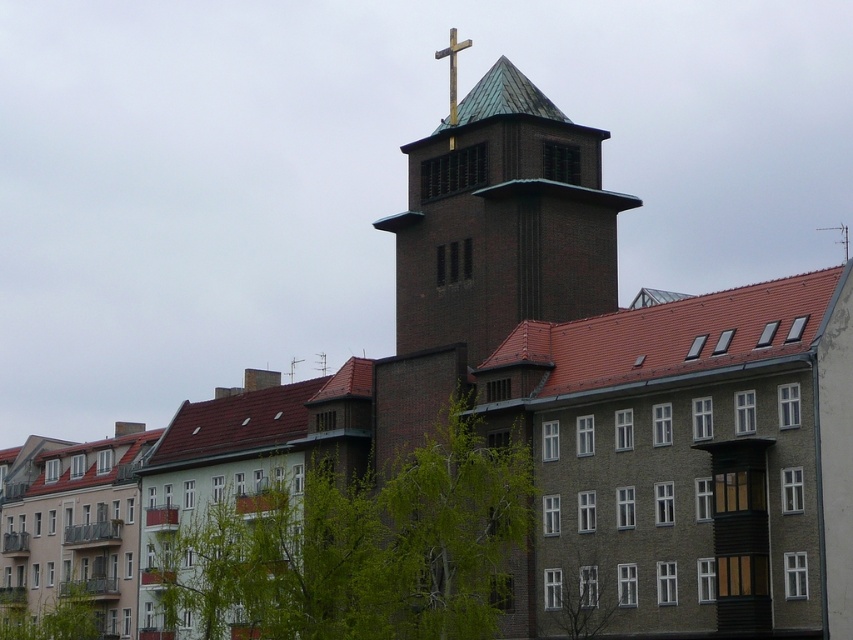
Question: Which of the following is the farthest from the observer?

Choices:
 (A) brown brick tower at center
 (B) gold metallic cross at upper center

Answer: (B)

Question: Is brown brick tower at center wider than gold metallic cross at upper center?

Choices:
 (A) no
 (B) yes

Answer: (B)

Question: Which of the following is the farthest from the observer?

Choices:
 (A) (477, 324)
 (B) (450, 44)

Answer: (B)

Question: Is brown brick tower at center wider than gold metallic cross at upper center?

Choices:
 (A) yes
 (B) no

Answer: (A)

Question: Is brown brick tower at center below gold metallic cross at upper center?

Choices:
 (A) no
 (B) yes

Answer: (B)

Question: Among these objects, which one is farthest from the camera?

Choices:
 (A) brown brick tower at center
 (B) gold metallic cross at upper center

Answer: (B)